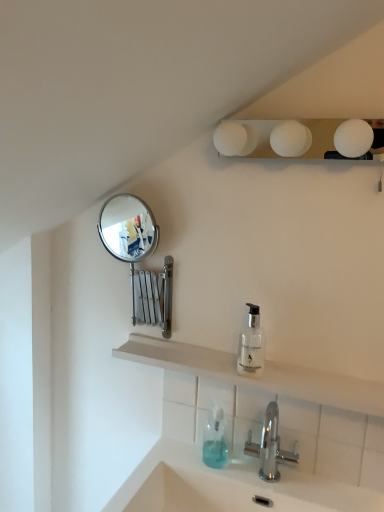
Locate an element on the screen. free spot below white matte light fixture at upper center (from a real-world perspective) is located at coordinates (309, 371).